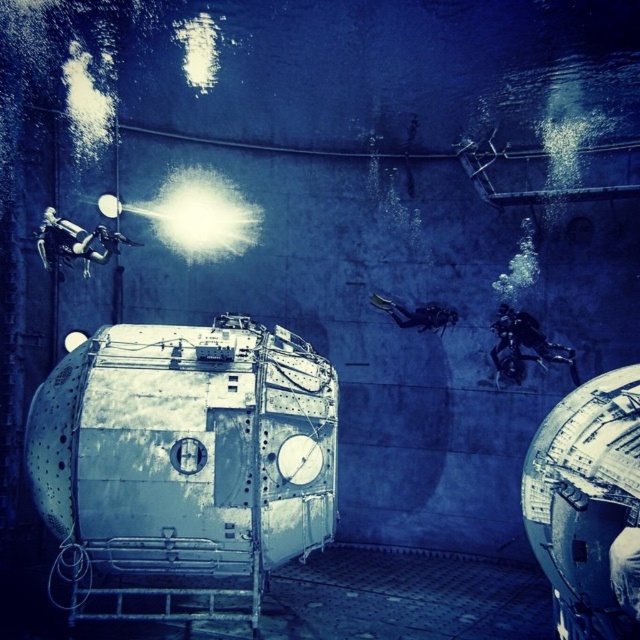
You are an astronaut preparing for a mission and notice the metallic industrial tank at center and the shiny black spacesuit at right in the underwater facility. Based on their positions, which object would you need to move first to access the one below it?

The metallic industrial tank at center is located below the shiny black spacesuit at right. To access the tank below, you would first need to move the shiny black spacesuit at right out of the way.

You are an underwater explorer and need to reach a point that is exactly 5 meters away from your current position. You see a point marked at coordinates point (246, 483) in the scene. Can you use this point to determine if you can reach your target distance?

The point (246, 483) is 5.23 meters from viewer, which is slightly beyond the 5 meter target distance. You can adjust your position to get closer or use this point as a reference to estimate distances in the environment.

You are an astronaut preparing for a mission and need to retrieve your equipment. You see a metallic industrial tank at center and a shiny black spacesuit at right. How far apart are these two objects?

The metallic industrial tank at center is 9.96 feet away from the shiny black spacesuit at right.